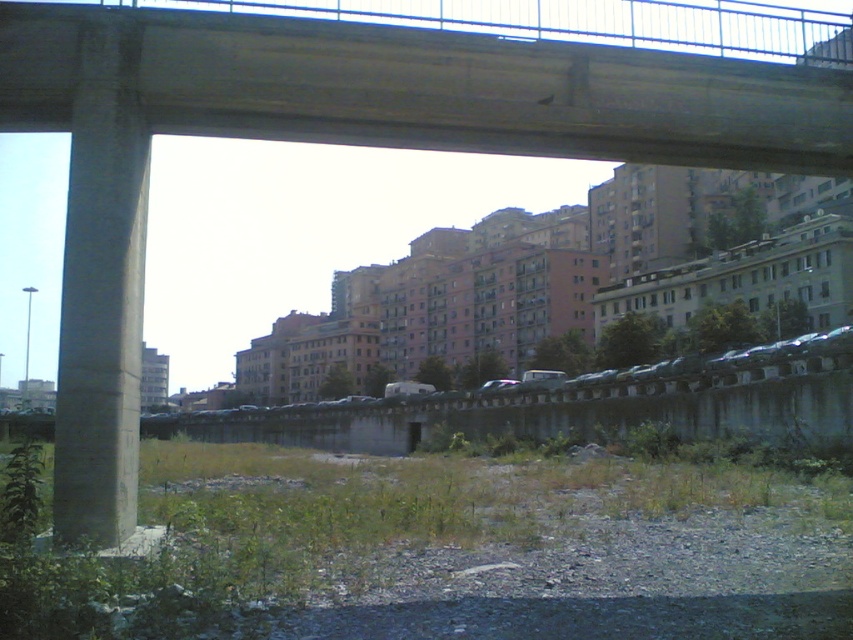
You are a delivery person trying to navigate through an urban area. You see a concrete at upper center and a concrete at left. How far apart are these two concrete structures?

The concrete at upper center and concrete at left are 19.92 feet apart from each other.

You are a gardener assessing the area under a bridge. You notice the concrete at left and the green leafy weed at lower left. Which object is shorter in height?

The concrete at left is shorter in height compared to the green leafy weed at lower left.